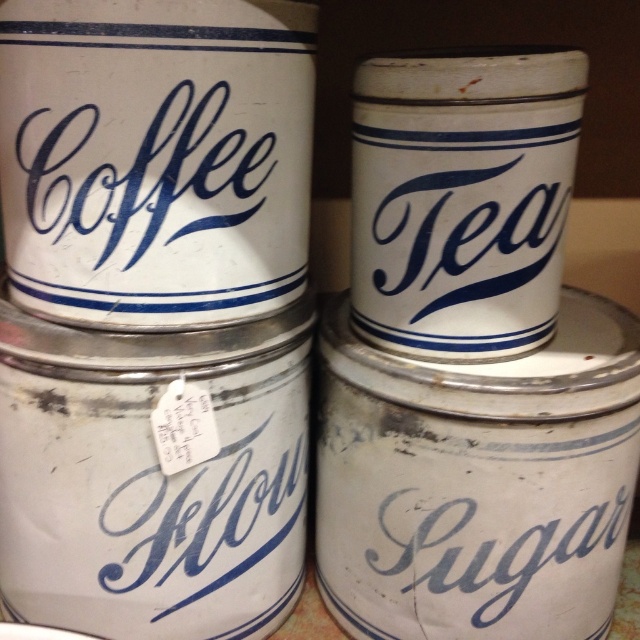
You are organizing a pantry and want to place the blue painted metal tea at upper right and the white matte sugar at lower right on a shelf. Which canister should you place first to ensure they fit properly?

The blue painted metal tea at upper right is smaller than the white matte sugar at lower right, so you should place the white matte sugar at lower right first to accommodate its larger size and ensure both fit properly.

Consider the image. You are organizing a display and need to place a decorative item between the blue painted metal tea at upper right and the white matte sugar at lower right. Based on their positions, which canister should the item be placed closer to?

The decorative item should be placed closer to the blue painted metal tea at upper right since it is closer to the viewer compared to the white matte sugar at lower right.

You are organizing a pantry and need to place the white matte sugar at lower right and the matte blue script coffee at upper left. Which canister is positioned lower in the stack?

The white matte sugar at lower right is positioned lower in the stack than the matte blue script coffee at upper left.